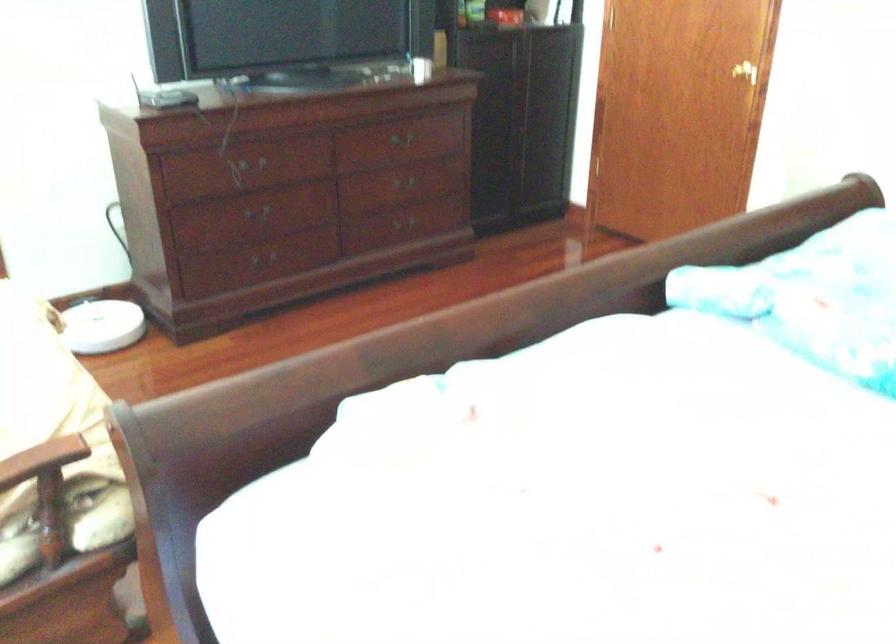
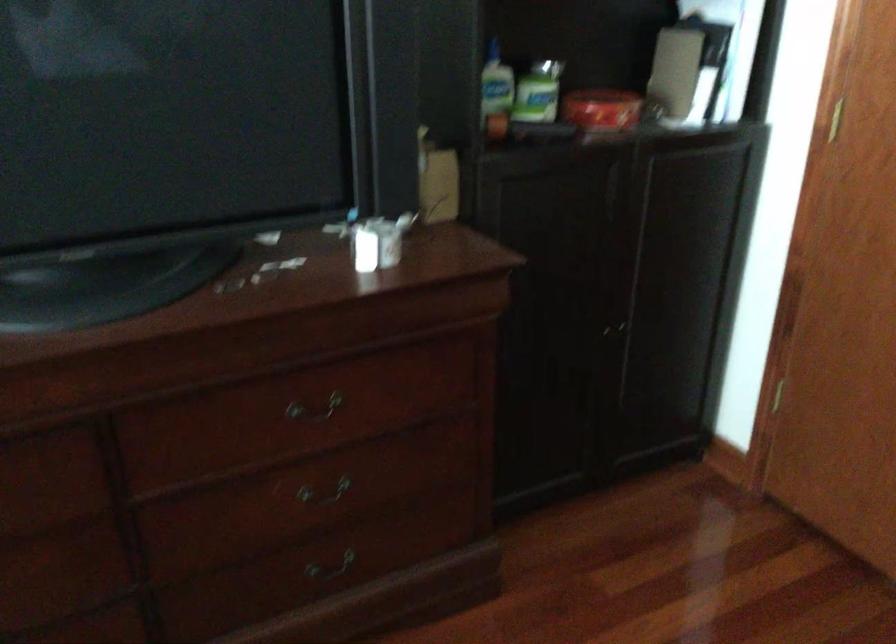
Where in the second image is the point corresponding to (398,182) from the first image?

(323, 491)